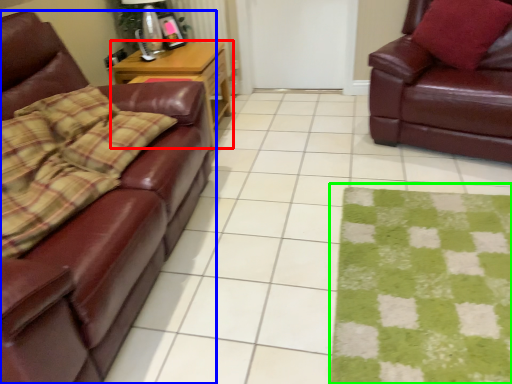
Question: Based on their relative distances, which object is nearer to table (highlighted by a red box)? Choose from studio couch (highlighted by a blue box) and mat (highlighted by a green box).

Choices:
 (A) studio couch
 (B) mat

Answer: (A)